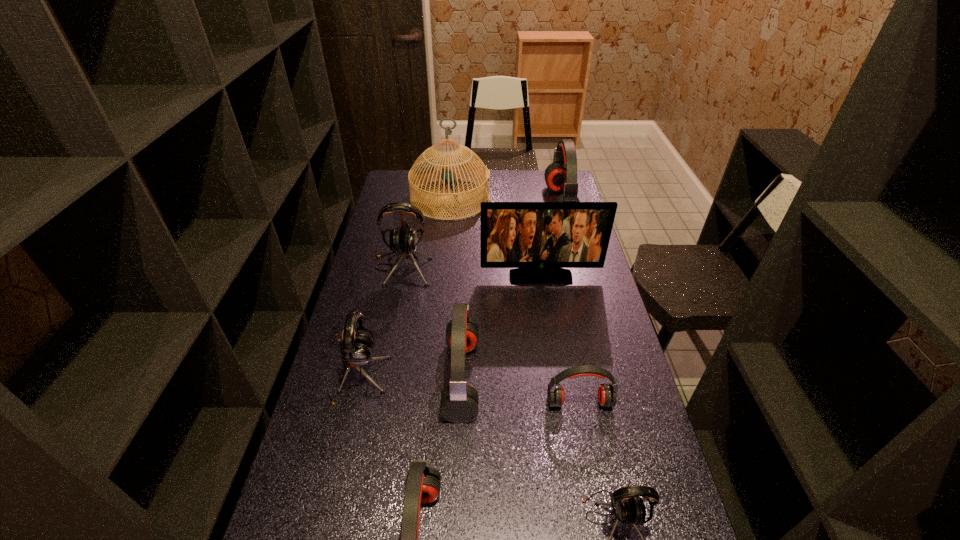
Where is `birdcage`? The width and height of the screenshot is (960, 540). birdcage is located at coordinates (425, 166).

Identify the location of monitor. The image size is (960, 540). (539, 239).

Where is `the farthest red earphone`? the farthest red earphone is located at coordinates (561, 175).

At what (x,y) coordinates should I click in order to perform the action: click on the farthest earphone. Please return your answer as a coordinate pair (x, y). The height and width of the screenshot is (540, 960). Looking at the image, I should click on (561, 175).

Image resolution: width=960 pixels, height=540 pixels. In order to click on the sixth nearest earphone in this screenshot , I will do `click(403, 241)`.

Identify the location of the farthest black earphone. Image resolution: width=960 pixels, height=540 pixels. (403, 241).

At what (x,y) coordinates should I click in order to perform the action: click on the second biggest red earphone. Please return your answer as a coordinate pair (x, y). The height and width of the screenshot is (540, 960). Looking at the image, I should click on (459, 403).

Locate an element on the screen. the second nearest black earphone is located at coordinates (357, 348).

The image size is (960, 540). I want to click on the shortest object, so click(x=607, y=397).

Where is `the shortest earphone`? The width and height of the screenshot is (960, 540). the shortest earphone is located at coordinates (607, 397).